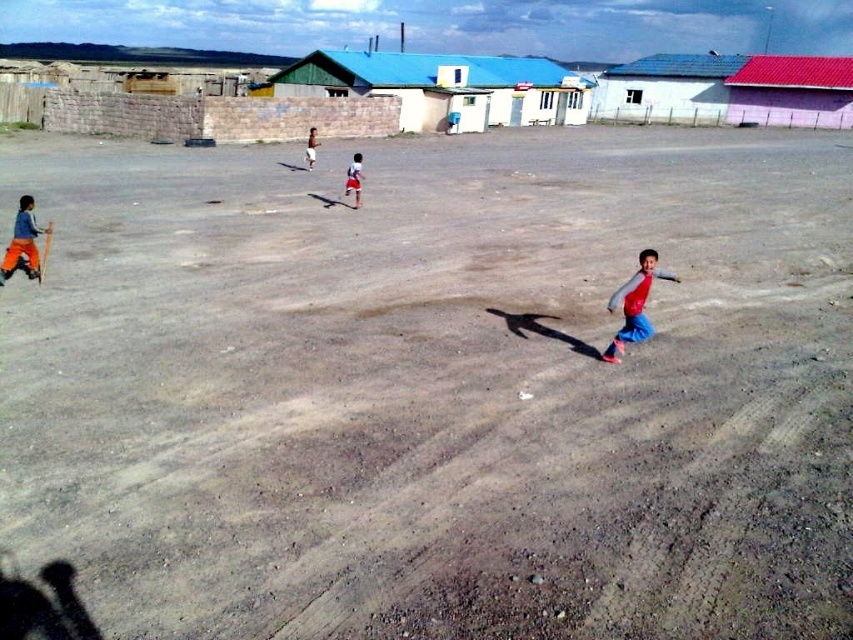
Question: Among these objects, which one is nearest to the camera?

Choices:
 (A) red fabric shirt at center
 (B) red cotton shirt at lower right
 (C) red fabric shorts at center
 (D) brushed orange pants at lower left

Answer: (B)

Question: Can you confirm if red fabric shirt at center is positioned above red fabric shorts at center?

Choices:
 (A) no
 (B) yes

Answer: (A)

Question: Can you confirm if red cotton shirt at lower right is positioned above brushed orange pants at lower left?

Choices:
 (A) yes
 (B) no

Answer: (B)

Question: Among these points, which one is nearest to the camera?

Choices:
 (A) (312, 154)
 (B) (361, 166)
 (C) (635, 276)
 (D) (33, 260)

Answer: (C)

Question: In this image, where is red cotton shirt at lower right located relative to brushed orange pants at lower left?

Choices:
 (A) right
 (B) left

Answer: (A)

Question: Which point is closer to the camera?

Choices:
 (A) (628, 300)
 (B) (358, 156)

Answer: (A)